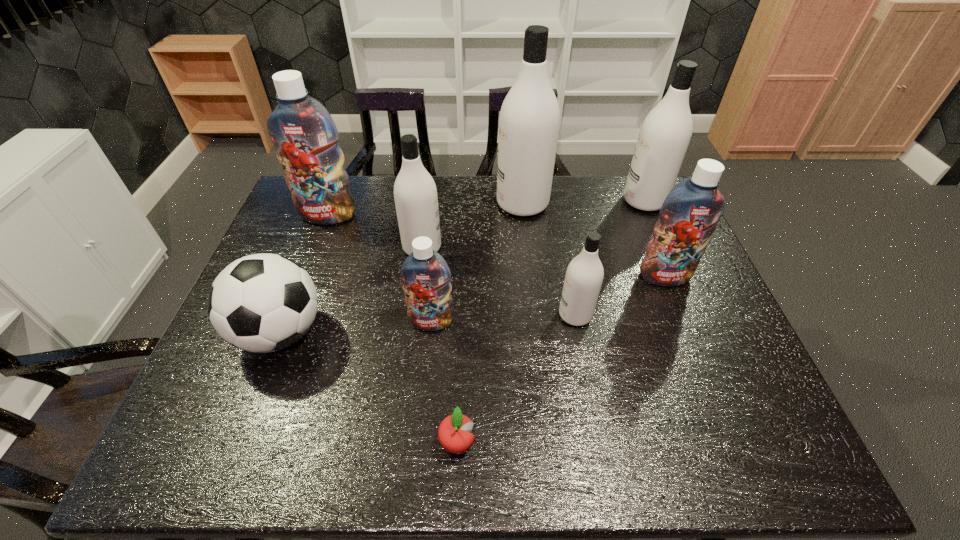
Locate which shampoo ranks third in proximity to the soccer ball. Please provide its 2D coordinates. Your answer should be formatted as a tuple, i.e. [(x, y)], where the tuple contains the x and y coordinates of a point satisfying the conditions above.

[(305, 137)]

I want to click on the closest white shampoo to the tallest object, so click(415, 193).

The height and width of the screenshot is (540, 960). Identify the location of white shampoo that can be found as the third closest to the second nearest white shampoo. (665, 134).

Point out which blue shampoo is positioned as the nearest to the nearest white shampoo. Please provide its 2D coordinates. Your answer should be formatted as a tuple, i.e. [(x, y)], where the tuple contains the x and y coordinates of a point satisfying the conditions above.

[(689, 215)]

Select which blue shampoo appears as the closest to the leftmost blue shampoo. Please provide its 2D coordinates. Your answer should be formatted as a tuple, i.e. [(x, y)], where the tuple contains the x and y coordinates of a point satisfying the conditions above.

[(426, 276)]

Image resolution: width=960 pixels, height=540 pixels. Identify the location of free point that satisfies the following two spatial constraints: 1. on the front-facing side of the tallest object; 2. on the front label of the nearest blue shampoo. (536, 322).

Find the location of a particular element. vacant space that satisfies the following two spatial constraints: 1. on the front-facing side of the leftmost white shampoo; 2. on the right side of the apple is located at coordinates (396, 443).

At what (x,y) coordinates should I click in order to perform the action: click on free region that satisfies the following two spatial constraints: 1. on the front-facing side of the smallest white shampoo; 2. on the front side of the soccer ball. Please return your answer as a coordinate pair (x, y). This screenshot has height=540, width=960. Looking at the image, I should click on (579, 333).

Locate an element on the screen. The width and height of the screenshot is (960, 540). free space that satisfies the following two spatial constraints: 1. on the front-facing side of the tallest shampoo; 2. on the front side of the eighth tallest object is located at coordinates (537, 333).